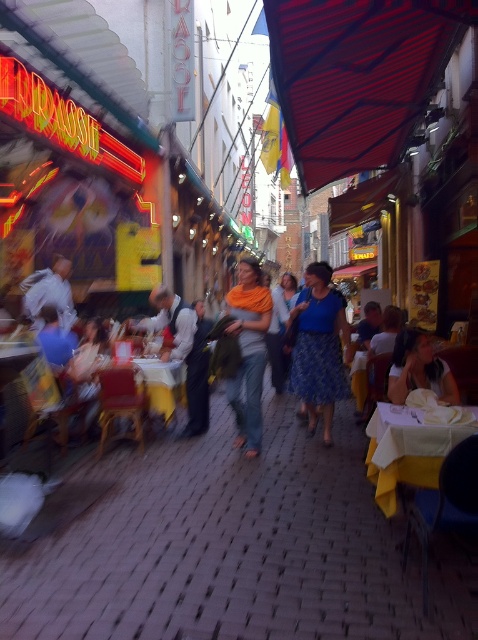
Does point (370, 468) come in front of point (138, 356)?

Yes, point (370, 468) is closer to viewer.

Can you confirm if white/yellow fabric table at center is wider than wooden table at center?

Indeed, white/yellow fabric table at center has a greater width compared to wooden table at center.

Which is behind, point (377, 435) or point (96, 371)?

The point (96, 371) is more distant.

Where is `white/yellow fabric table at center`? The height and width of the screenshot is (640, 478). white/yellow fabric table at center is located at coordinates (408, 451).

Is white fabric shirt at center further to the viewer compared to wooden table at center?

No.

Who is more forward, (401,384) or (177,360)?

Point (401,384) is more forward.

Between point (392, 394) and point (141, 376), which one is positioned in front?

Positioned in front is point (392, 394).

What are the coordinates of `white fabric shirt at center` in the screenshot? It's located at (419, 369).

Is point (319, 291) positioned before point (250, 448)?

No, (319, 291) is further to viewer.

Who is lower down, blue printed skirt at center or orange scarf at center?

blue printed skirt at center is below.

You are a GUI agent. You are given a task and a screenshot of the screen. Output one action in this format:
    pyautogui.click(x=<x>, y=<y>)
    Task: Click on the blue printed skirt at center
    The width and height of the screenshot is (478, 640).
    Given the screenshot: What is the action you would take?
    point(318,348)

Image resolution: width=478 pixels, height=640 pixels. I want to click on blue printed skirt at center, so click(318, 348).